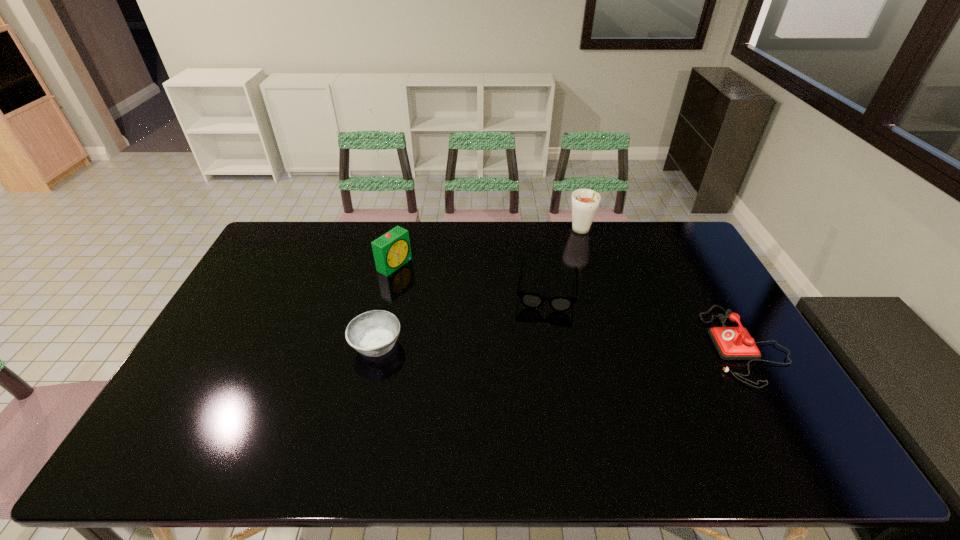
Where is `ashtray`? The height and width of the screenshot is (540, 960). ashtray is located at coordinates (373, 333).

Locate an element on the screen. The height and width of the screenshot is (540, 960). telephone is located at coordinates (732, 343).

The image size is (960, 540). Identify the location of the rightmost object. (732, 343).

Where is `the third object from left to right`? This screenshot has height=540, width=960. the third object from left to right is located at coordinates (530, 300).

The height and width of the screenshot is (540, 960). In order to click on the second tallest object in this screenshot , I will do `click(392, 250)`.

What are the coordinates of `the farthest object` in the screenshot? It's located at (585, 202).

You are a GUI agent. You are given a task and a screenshot of the screen. Output one action in this format:
    pyautogui.click(x=<x>, y=<y>)
    Task: Click on the tallest object
    
    Given the screenshot: What is the action you would take?
    pyautogui.click(x=585, y=202)

You are a GUI agent. You are given a task and a screenshot of the screen. Output one action in this format:
    pyautogui.click(x=<x>, y=<y>)
    Task: Click on the free location located 0.170m on the back of the ashtray
    
    Given the screenshot: What is the action you would take?
    pyautogui.click(x=390, y=287)

Find the location of a particular element. blank space located 0.200m on the dial of the telephone is located at coordinates (639, 345).

The height and width of the screenshot is (540, 960). I want to click on vacant space located on the dial of the telephone, so click(x=639, y=345).